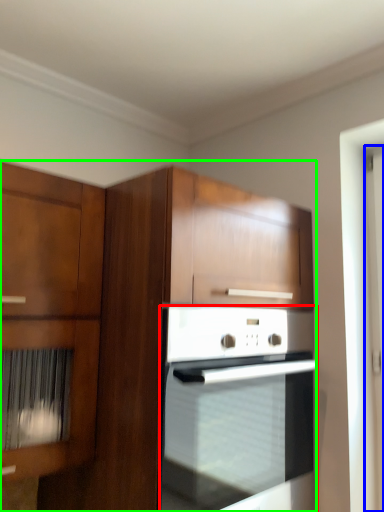
Question: Considering the real-world distances, which object is farthest from oven (highlighted by a red box)? screen door (highlighted by a blue box) or cabinetry (highlighted by a green box)?

Choices:
 (A) screen door
 (B) cabinetry

Answer: (A)